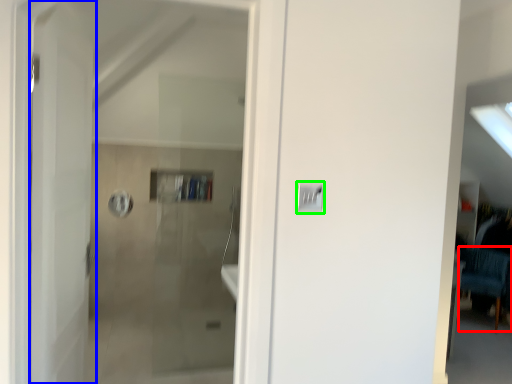
Question: Which is nearer to the furniture (highlighted by a red box)? door (highlighted by a blue box) or light switch (highlighted by a green box).

Choices:
 (A) door
 (B) light switch

Answer: (B)